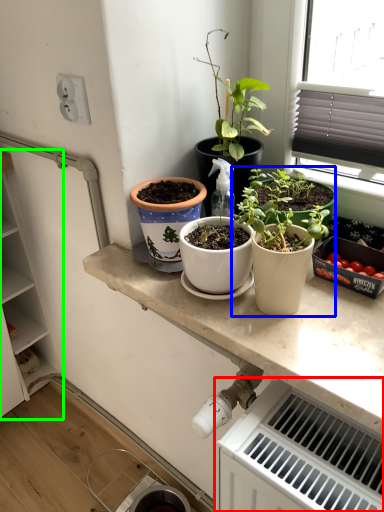
Question: Based on their relative distances, which object is farther from radiator (highlighted by a red box)? Choose from houseplant (highlighted by a blue box) and cabinetry (highlighted by a green box).

Choices:
 (A) houseplant
 (B) cabinetry

Answer: (B)